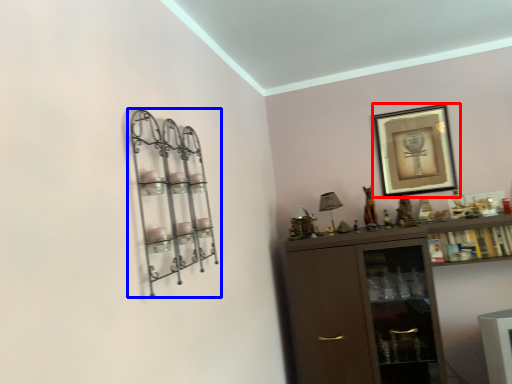
Question: Among these objects, which one is farthest to the camera, picture frame (highlighted by a red box) or shelf (highlighted by a blue box)?

Choices:
 (A) picture frame
 (B) shelf

Answer: (A)